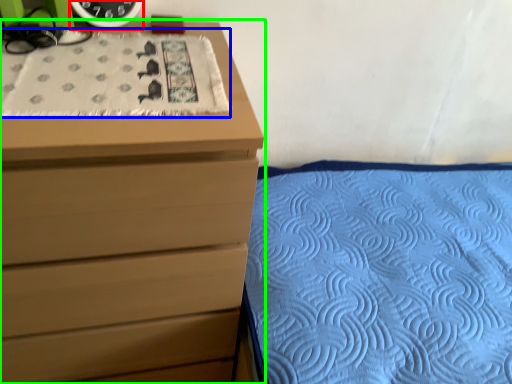
Question: Which is nearer to the clock (highlighted by a red box)? blanket (highlighted by a blue box) or chest of drawers (highlighted by a green box).

Choices:
 (A) blanket
 (B) chest of drawers

Answer: (A)